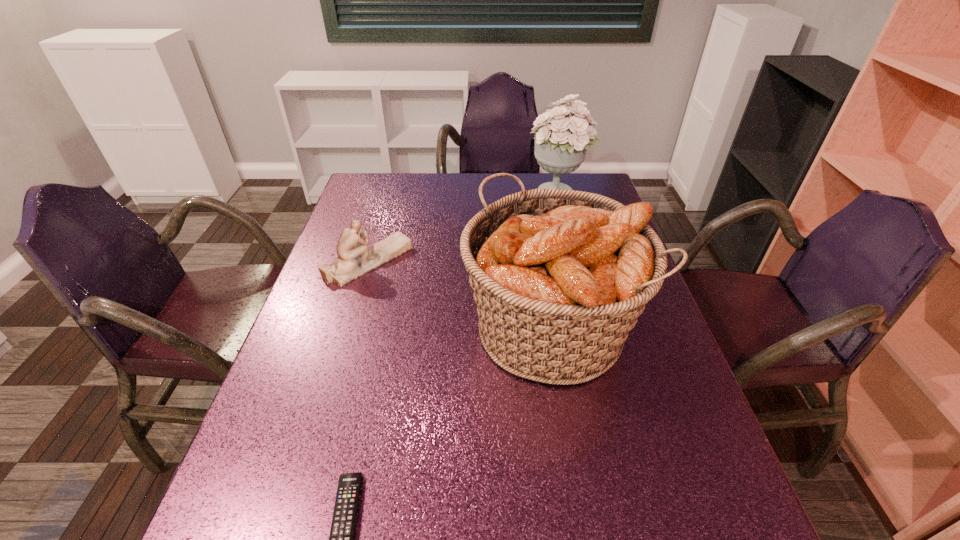
This screenshot has height=540, width=960. I want to click on the farthest object, so click(560, 147).

In order to click on basket in this screenshot , I will do `click(559, 276)`.

I want to click on figurine, so click(x=354, y=259).

Image resolution: width=960 pixels, height=540 pixels. I want to click on free spot located 0.060m on the right of the farthest object, so click(607, 194).

Find the location of a particular element. blank space located on the back of the basket is located at coordinates (530, 207).

Where is `free space located 0.070m on the front-facing side of the figurine`? free space located 0.070m on the front-facing side of the figurine is located at coordinates click(x=436, y=261).

The image size is (960, 540). Identify the location of object situated at the far edge. (560, 147).

This screenshot has width=960, height=540. What are the coordinates of `object situated at the left edge` in the screenshot? It's located at (354, 259).

Find the location of a particular element. The height and width of the screenshot is (540, 960). bouquet present at the right edge is located at coordinates (560, 147).

This screenshot has height=540, width=960. What are the coordinates of `basket present at the right edge` in the screenshot? It's located at (559, 276).